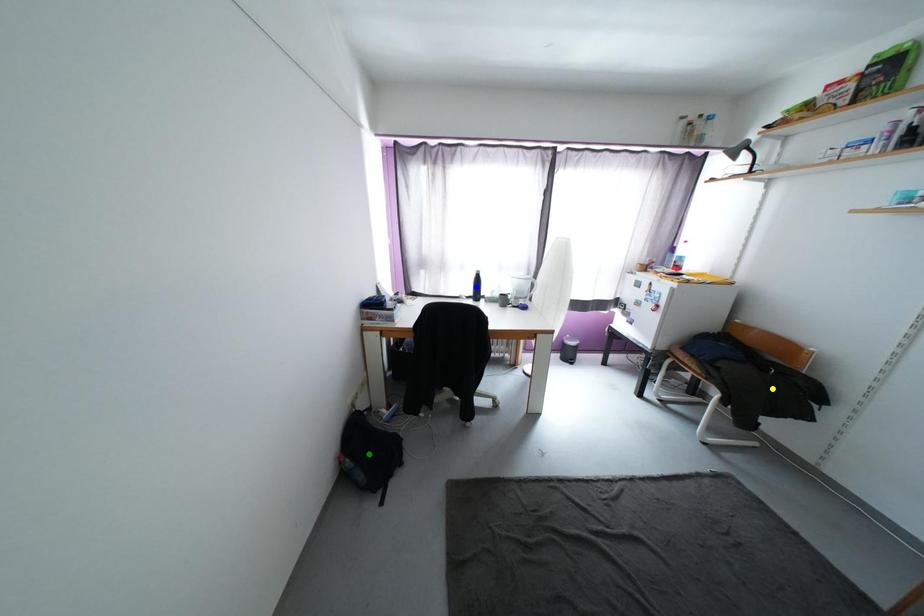
Order these from nearest to farthest:
1. blue point
2. green point
3. yellow point

yellow point, green point, blue point